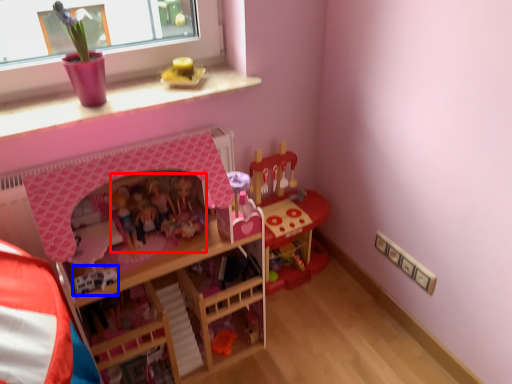
Question: Among these objects, which one is nearest to the camera, toy (highlighted by a red box) or toy (highlighted by a blue box)?

Choices:
 (A) toy
 (B) toy

Answer: (B)